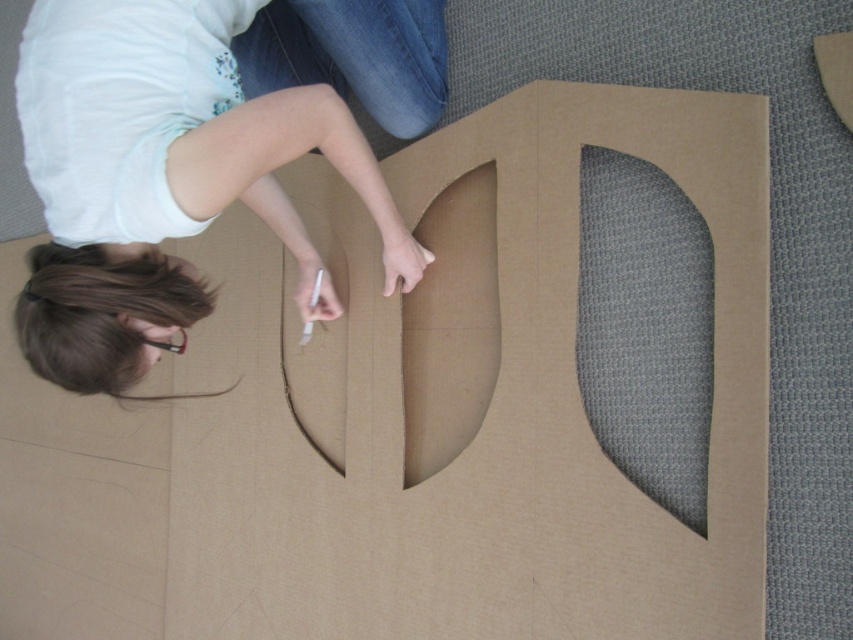
You are a delivery robot that needs to place a package on the brown cardboard at center. The package requires a clear space of 36 inches between the edge of the cardboard and any other objects. Can you safely place the package there?

The brown cardboard at center has a space of 36.16 inches between its edge and other objects, which meets the required 36 inches. Therefore, you can safely place the package there.

Please describe the location of the point at coordinates [485,416] in the image of the crafting scene.

The point at coordinates [485,416] is located on the brown cardboard at center.

You are a photographer setting up for a portrait. You need to ensure that the brown cardboard at center and the matte brown hair at upper left are both visible in the frame. Based on their positions, which object should you adjust to be closer to the center of the frame to achieve this?

The matte brown hair at upper left should be moved closer to the center since the brown cardboard at center is already positioned on the right side of it, making the cardboard farther from the center than the hair.